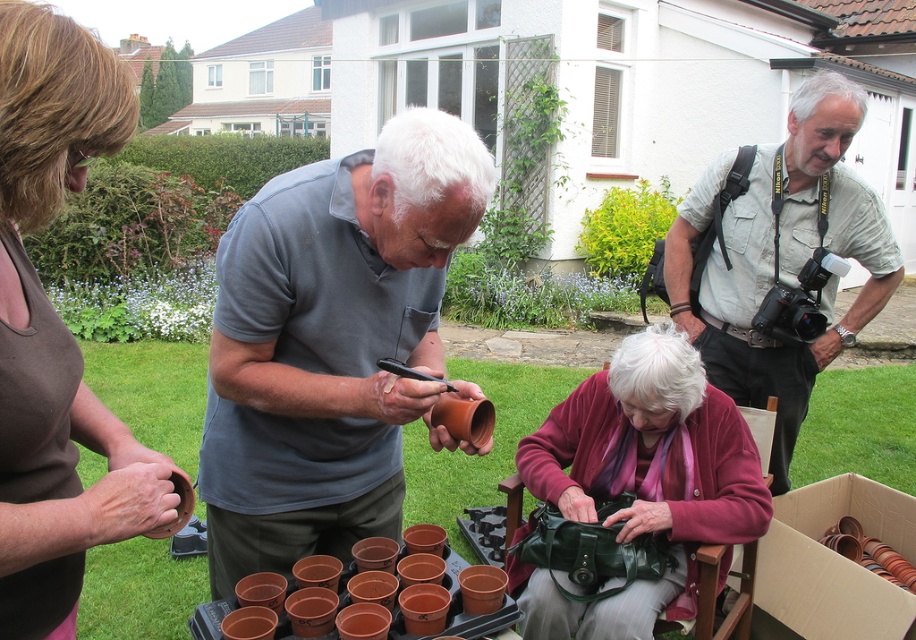
Question: Which object is closer to the camera taking this photo?

Choices:
 (A) brown plastic tray at lower center
 (B) brown cardboard box at lower right

Answer: (A)

Question: Does khaki cotton shirt at upper right come behind brown cardboard box at lower right?

Choices:
 (A) yes
 (B) no

Answer: (A)

Question: Is brown matte tank top at upper left above brown cardboard box at lower right?

Choices:
 (A) no
 (B) yes

Answer: (B)

Question: Among these objects, which one is nearest to the camera?

Choices:
 (A) brown plastic tray at lower center
 (B) khaki cotton shirt at upper right

Answer: (A)

Question: Is velvet purple scarf at center closer to camera compared to brown plastic tray at lower center?

Choices:
 (A) yes
 (B) no

Answer: (B)

Question: Which object appears farthest from the camera in this image?

Choices:
 (A) khaki cotton shirt at upper right
 (B) matte gray shirt at center

Answer: (A)